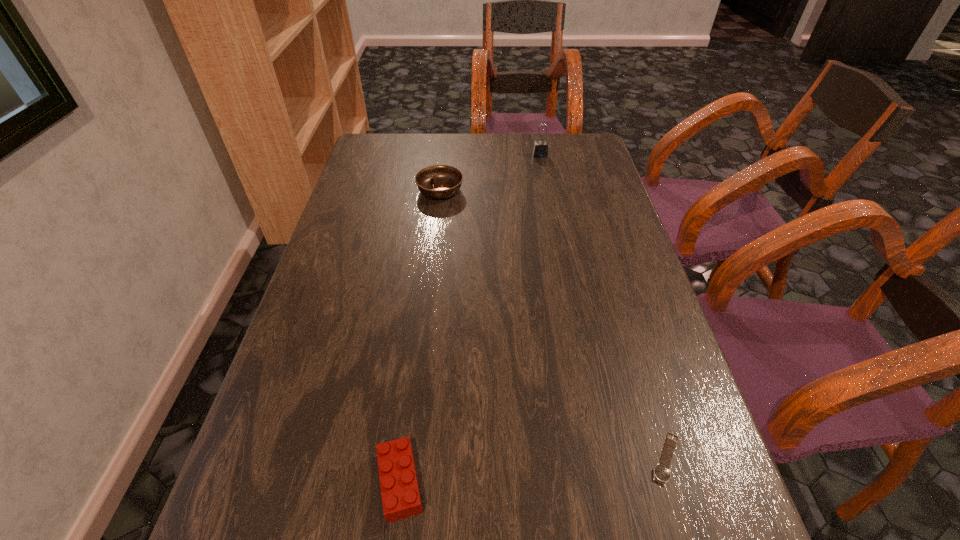
Find the location of a particular element. Image resolution: width=960 pixels, height=540 pixels. blank region between the Lego and the tallest object is located at coordinates (470, 319).

Where is `free space between the Lego and the watch`? free space between the Lego and the watch is located at coordinates (533, 470).

The width and height of the screenshot is (960, 540). Find the location of `vacant space that's between the third nearest object and the rightmost object`. vacant space that's between the third nearest object and the rightmost object is located at coordinates (553, 325).

I want to click on vacant space that's between the soup bowl and the farthest object, so click(491, 173).

Where is `free space between the tallest object and the Lego`? The width and height of the screenshot is (960, 540). free space between the tallest object and the Lego is located at coordinates (470, 319).

Locate which object ranks second in proximity to the second farthest object. Please provide its 2D coordinates. Your answer should be formatted as a tuple, i.e. [(x, y)], where the tuple contains the x and y coordinates of a point satisfying the conditions above.

[(400, 493)]

This screenshot has height=540, width=960. Find the location of `object that is the closest to the farthest object`. object that is the closest to the farthest object is located at coordinates coord(437,181).

You are a GUI agent. You are given a task and a screenshot of the screen. Output one action in this format:
    pyautogui.click(x=<x>, y=<y>)
    Task: Click on the vacant space that satisfies the following two spatial constraints: 1. on the shackle of the shortest object; 2. on the right side of the third object from left to right
    The width and height of the screenshot is (960, 540).
    Given the screenshot: What is the action you would take?
    pyautogui.click(x=597, y=458)